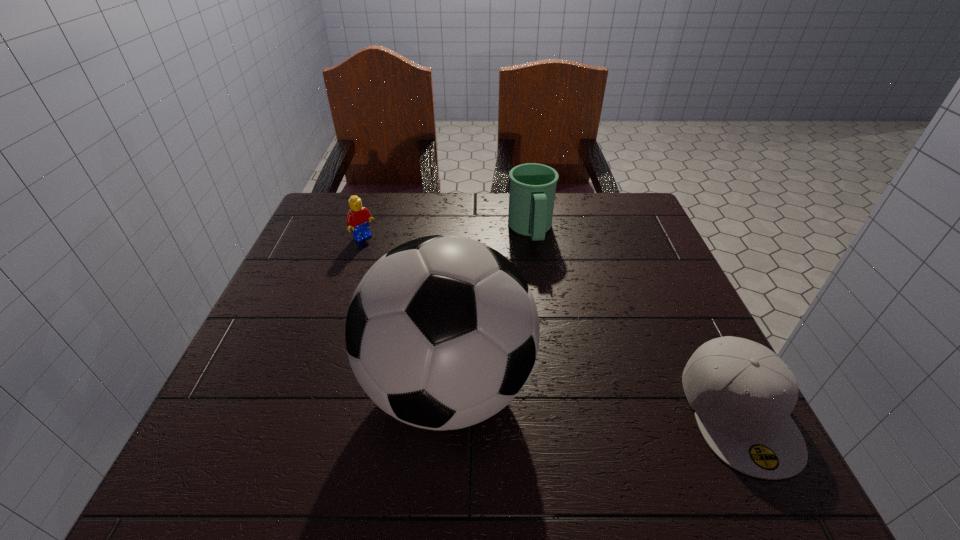
Image resolution: width=960 pixels, height=540 pixels. I want to click on the tallest object, so [x=442, y=332].

Where is `the rightmost object`? The image size is (960, 540). the rightmost object is located at coordinates (742, 393).

Where is `the shortest object`? The width and height of the screenshot is (960, 540). the shortest object is located at coordinates (742, 393).

Where is `the leftmost object`? the leftmost object is located at coordinates (358, 218).

You are a GUI agent. You are given a task and a screenshot of the screen. Output one action in this format:
    pyautogui.click(x=<x>, y=<y>)
    Task: Click on the Lego
    
    Given the screenshot: What is the action you would take?
    pyautogui.click(x=358, y=218)

At what (x,y) coordinates should I click in order to perform the action: click on the second tallest object. Please return your answer as a coordinate pair (x, y). Image resolution: width=960 pixels, height=540 pixels. Looking at the image, I should click on (532, 192).

This screenshot has height=540, width=960. What are the coordinates of `vacant region located on the back of the tallest object` in the screenshot? It's located at (456, 266).

Locate an element on the screen. This screenshot has height=540, width=960. vacant space located 0.050m on the front-facing side of the third tallest object is located at coordinates (381, 253).

Locate an element on the screen. free region located 0.240m on the front-facing side of the third tallest object is located at coordinates pos(428,291).

Locate an element on the screen. vacant region located 0.170m on the front-facing side of the third tallest object is located at coordinates (410, 276).